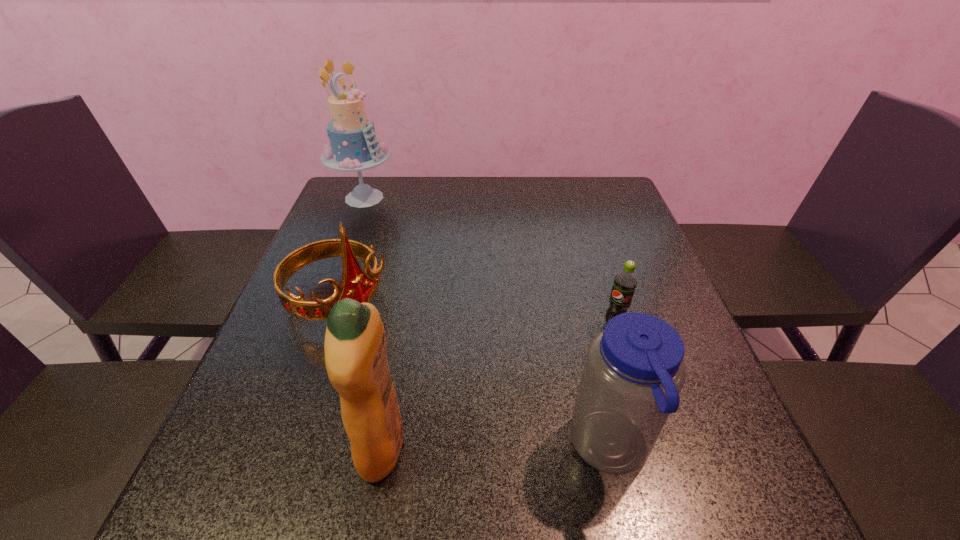
Identify the location of vacant space that's between the soda and the tiara. (476, 313).

Locate an element on the screen. free spot between the tallest object and the water bottle is located at coordinates (488, 323).

The height and width of the screenshot is (540, 960). I want to click on free space between the detergent and the water bottle, so click(496, 448).

Find the location of a particular element. The image size is (960, 540). the second closest object to the third object from left to right is located at coordinates [634, 370].

The width and height of the screenshot is (960, 540). In order to click on object that is the second closest one to the cake in this screenshot , I will do `click(355, 348)`.

The width and height of the screenshot is (960, 540). Identify the location of free space that satisfies the following two spatial constraints: 1. on the front side of the detergent; 2. on the label of the tiara. (288, 447).

Where is `vacant point that satisfies the following two spatial constraints: 1. on the front side of the cake; 2. with a carrying loop on the side of the water bottle`? This screenshot has width=960, height=540. vacant point that satisfies the following two spatial constraints: 1. on the front side of the cake; 2. with a carrying loop on the side of the water bottle is located at coordinates (270, 449).